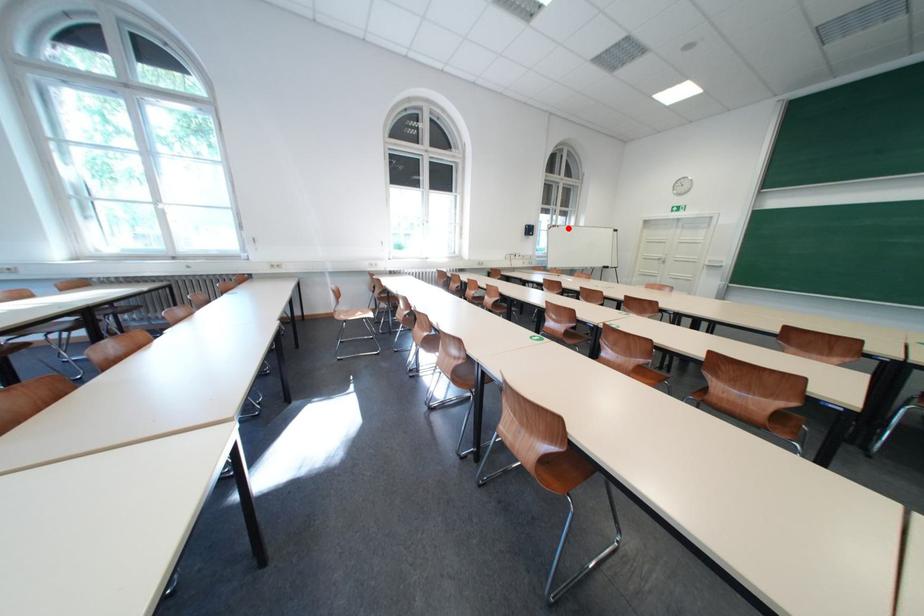
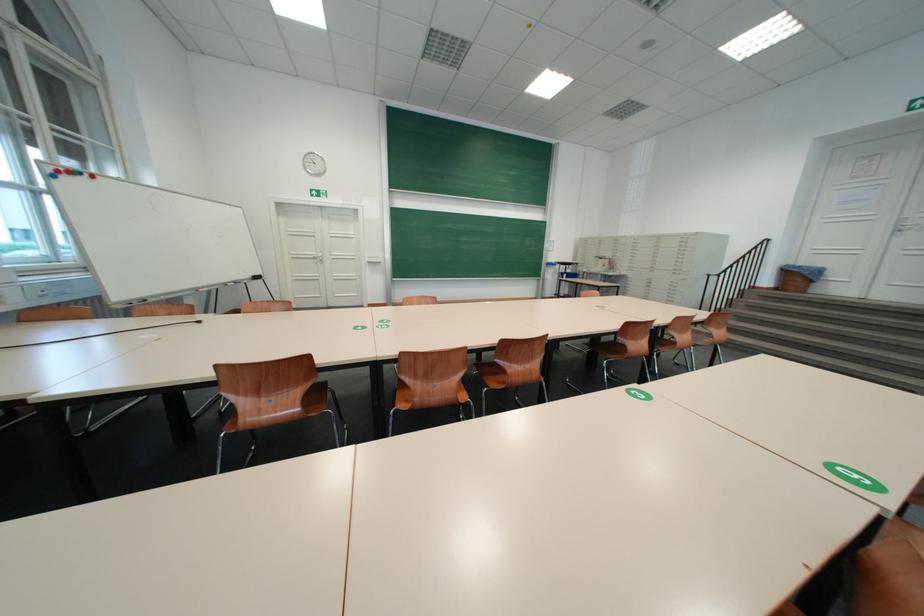
Question: I am providing you with two images of the same scene from different viewpoints. A red point is shown in image1. For the corresponding object point in image2, is it positioned nearer or farther from the camera?

Choices:
 (A) Nearer
 (B) Farther

Answer: (B)